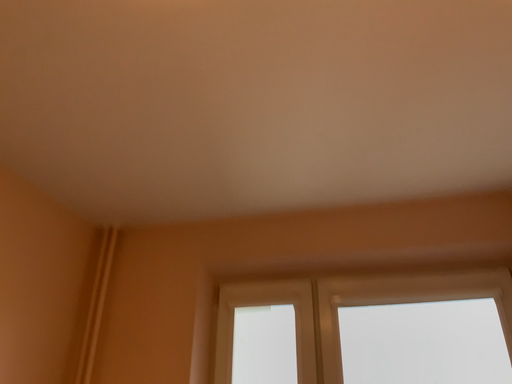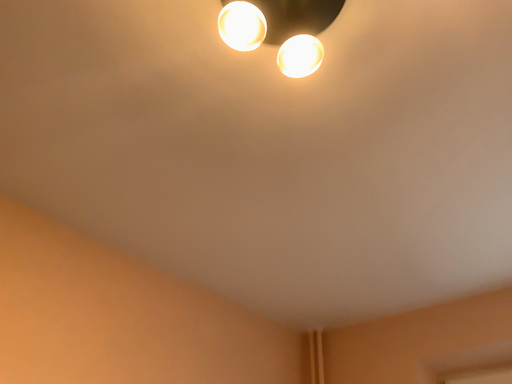
Question: How did the camera likely rotate when shooting the video?

Choices:
 (A) rotated downward
 (B) rotated upward

Answer: (B)